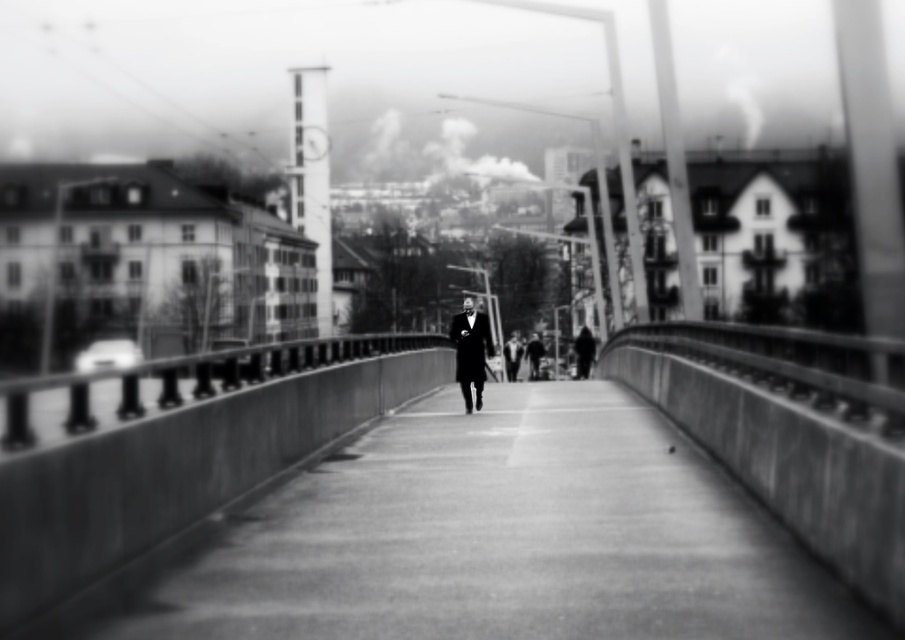
Question: Which point is closer to the camera taking this photo?

Choices:
 (A) (464, 388)
 (B) (627, 452)

Answer: (B)

Question: Considering the relative positions of smooth concrete path at center and black wool coat at center in the image provided, where is smooth concrete path at center located with respect to black wool coat at center?

Choices:
 (A) right
 (B) left

Answer: (A)

Question: Can you confirm if smooth concrete path at center is smaller than black wool coat at center?

Choices:
 (A) no
 (B) yes

Answer: (B)

Question: Considering the relative positions of smooth concrete path at center and black wool coat at center in the image provided, where is smooth concrete path at center located with respect to black wool coat at center?

Choices:
 (A) right
 (B) left

Answer: (A)